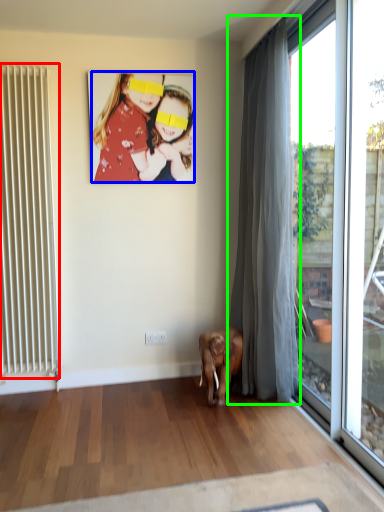
Question: Which object is positioned farthest from radiator (highlighted by a red box)? Select from person (highlighted by a blue box) and curtain (highlighted by a green box).

Choices:
 (A) person
 (B) curtain

Answer: (B)